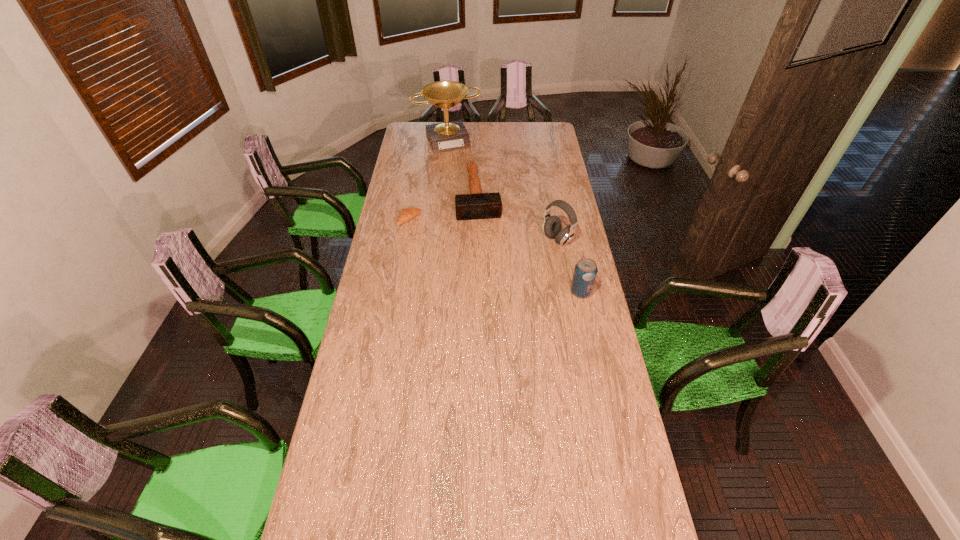
Where is `vacant space on the desktop that is between the crescent roll and the pop soda and is positioned on the ear cups of the second nearest object`? vacant space on the desktop that is between the crescent roll and the pop soda and is positioned on the ear cups of the second nearest object is located at coordinates (514, 263).

Image resolution: width=960 pixels, height=540 pixels. Find the location of `free spot on the desktop that is between the shortest object and the nearest object and is positioned on the front-facing side of the tallest object`. free spot on the desktop that is between the shortest object and the nearest object and is positioned on the front-facing side of the tallest object is located at coordinates click(x=505, y=260).

The image size is (960, 540). I want to click on vacant space on the desktop that is between the crescent roll and the pop soda and is positioned on the striking face of the second shortest object, so click(488, 252).